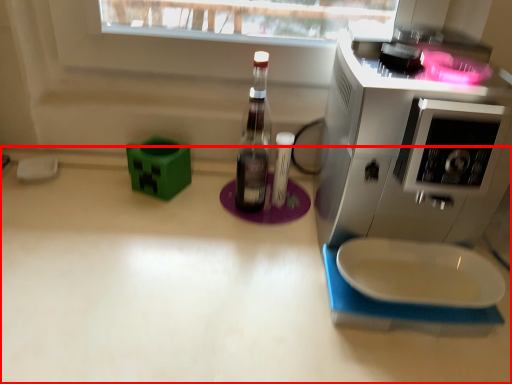
Question: From the image's perspective, where is countertop (annotated by the red box) located relative to home appliance?

Choices:
 (A) below
 (B) above

Answer: (A)